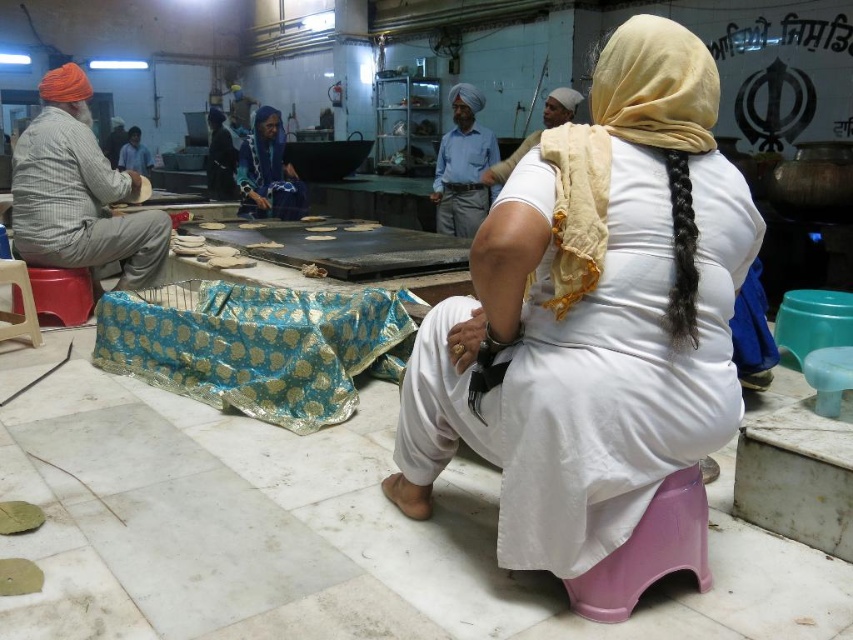
Is yellow fabric at upper right bigger than matte orange turban at left?

Actually, yellow fabric at upper right might be smaller than matte orange turban at left.

Who is more distant from viewer, (584,145) or (96,243)?

The point (96,243) is more distant.

Is point (683, 52) positioned before point (78, 218)?

Yes, point (683, 52) is closer to viewer.

Identify the location of yellow fabric at upper right. The height and width of the screenshot is (640, 853). (636, 145).

Which is more to the left, blue fabric at center or dark blue fabric at center?

Positioned to the left is dark blue fabric at center.

Is blue fabric at center above dark blue fabric at center?

Incorrect, blue fabric at center is not positioned above dark blue fabric at center.

Is point (254, 186) in front of point (215, 140)?

Yes, it is.

The image size is (853, 640). I want to click on blue fabric at center, so click(x=267, y=172).

Between point (675, 483) and point (224, 131), which one is positioned in front?

Point (675, 483) is more forward.

Which is more to the left, matte plastic stool at lower center or dark blue fabric at center?

From the viewer's perspective, dark blue fabric at center appears more on the left side.

Does point (680, 531) come farther from viewer compared to point (231, 173)?

No, it is in front of (231, 173).

You are a GUI agent. You are given a task and a screenshot of the screen. Output one action in this format:
    pyautogui.click(x=<x>, y=<y>)
    Task: Click on the matte plastic stool at lower center
    The height and width of the screenshot is (640, 853).
    Given the screenshot: What is the action you would take?
    pyautogui.click(x=648, y=552)